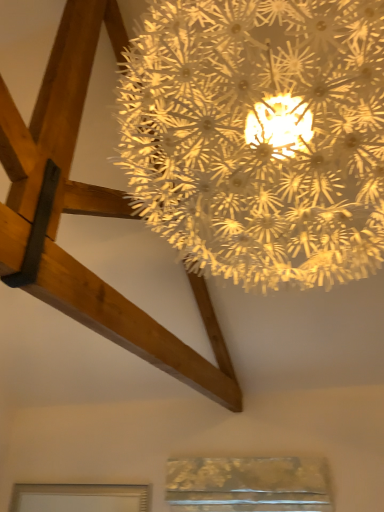
Question: From a real-world perspective, does matte silver frame at lower left, acting as the 2th window starting from the right, sit lower than metallic gold window at lower center, placed as the 1th window when sorted from right to left?

Choices:
 (A) no
 (B) yes

Answer: (B)

Question: Considering the relative sizes of matte silver frame at lower left, acting as the 2th window starting from the right, and metallic gold window at lower center, acting as the second window starting from the left, in the image provided, is matte silver frame at lower left, acting as the 2th window starting from the right, shorter than metallic gold window at lower center, acting as the second window starting from the left,?

Choices:
 (A) yes
 (B) no

Answer: (A)

Question: Can you confirm if matte silver frame at lower left, acting as the 2th window starting from the right, is wider than metallic gold window at lower center, acting as the second window starting from the left?

Choices:
 (A) no
 (B) yes

Answer: (A)

Question: Is matte silver frame at lower left, acting as the 2th window starting from the right, to the right of metallic gold window at lower center, placed as the 1th window when sorted from right to left, from the viewer's perspective?

Choices:
 (A) no
 (B) yes

Answer: (A)

Question: Is matte silver frame at lower left, acting as the 2th window starting from the right, far away from metallic gold window at lower center, acting as the second window starting from the left?

Choices:
 (A) yes
 (B) no

Answer: (B)

Question: Does matte silver frame at lower left, the first window in the left-to-right sequence, turn towards metallic gold window at lower center, placed as the 1th window when sorted from right to left?

Choices:
 (A) no
 (B) yes

Answer: (A)

Question: Is metallic gold window at lower center, placed as the 1th window when sorted from right to left, at the right side of matte silver frame at lower left, acting as the 2th window starting from the right?

Choices:
 (A) no
 (B) yes

Answer: (B)

Question: Does metallic gold window at lower center, placed as the 1th window when sorted from right to left, have a greater height compared to matte silver frame at lower left, acting as the 2th window starting from the right?

Choices:
 (A) yes
 (B) no

Answer: (A)

Question: Does metallic gold window at lower center, placed as the 1th window when sorted from right to left, have a smaller size compared to matte silver frame at lower left, the first window in the left-to-right sequence?

Choices:
 (A) no
 (B) yes

Answer: (A)

Question: From the image's perspective, is metallic gold window at lower center, acting as the second window starting from the left, located above matte silver frame at lower left, acting as the 2th window starting from the right?

Choices:
 (A) yes
 (B) no

Answer: (A)

Question: From a real-world perspective, is metallic gold window at lower center, acting as the second window starting from the left, under matte silver frame at lower left, acting as the 2th window starting from the right?

Choices:
 (A) no
 (B) yes

Answer: (A)

Question: Is metallic gold window at lower center, acting as the second window starting from the left, shorter than matte silver frame at lower left, the first window in the left-to-right sequence?

Choices:
 (A) yes
 (B) no

Answer: (B)

Question: From the image's perspective, is matte silver frame at lower left, the first window in the left-to-right sequence, on illuminated paper-like at upper center?

Choices:
 (A) yes
 (B) no

Answer: (B)